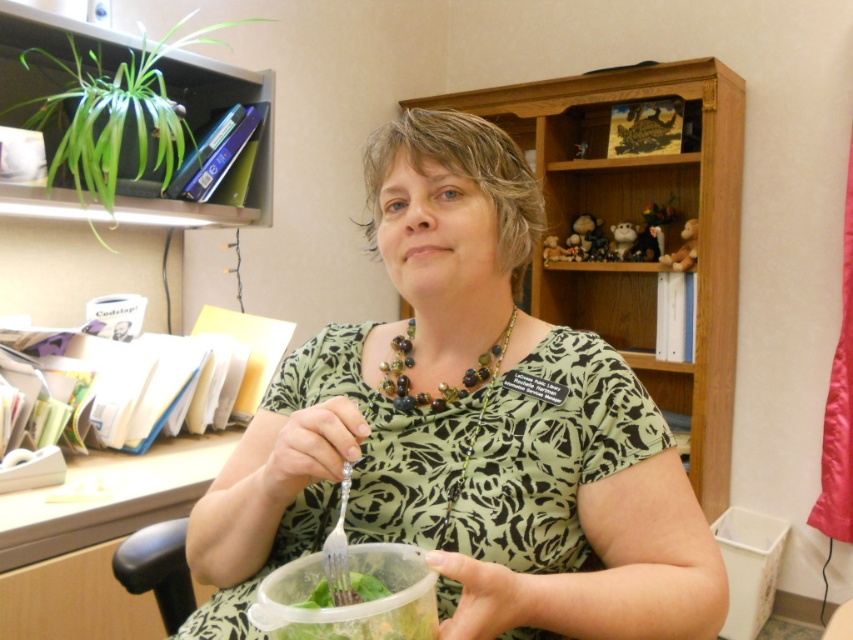
Question: Which point appears farthest from the camera in this image?

Choices:
 (A) (311, 570)
 (B) (474, 374)
 (C) (178, 513)
 (D) (544, 429)

Answer: (C)

Question: Is the position of green floral shirt at center more distant than that of wooden desk at left?

Choices:
 (A) yes
 (B) no

Answer: (B)

Question: Which point appears closest to the camera in this image?

Choices:
 (A) (155, 500)
 (B) (476, 376)
 (C) (585, 403)
 (D) (410, 577)

Answer: (D)

Question: Which of the following is the closest to the observer?

Choices:
 (A) (299, 419)
 (B) (399, 580)
 (C) (482, 372)

Answer: (A)

Question: Is wooden desk at left to the right of multicolored beaded necklace at center from the viewer's perspective?

Choices:
 (A) yes
 (B) no

Answer: (B)

Question: Is green floral shirt at center positioned at the back of wooden desk at left?

Choices:
 (A) no
 (B) yes

Answer: (A)